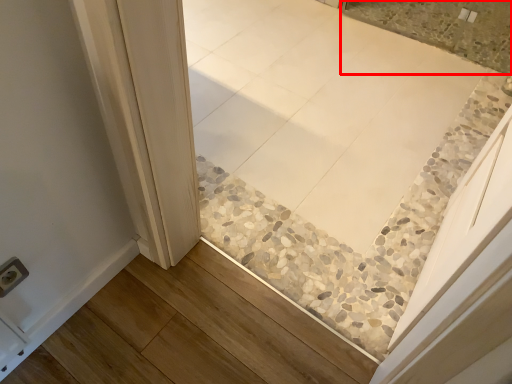
Question: In this image, where is tile (annotated by the red box) located relative to electric outlet?

Choices:
 (A) left
 (B) right

Answer: (B)